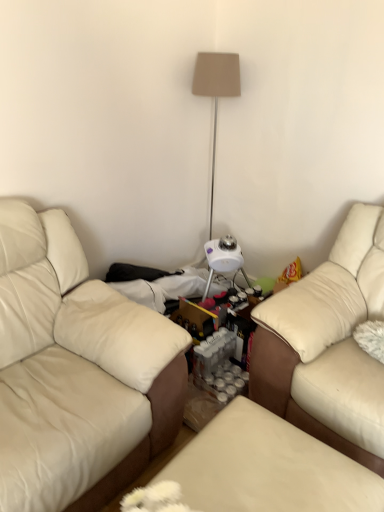
The height and width of the screenshot is (512, 384). What are the coordinates of `leather ottoman at center` in the screenshot? It's located at pos(268,468).

Where is `beige fabric lampshade at upper center`? The height and width of the screenshot is (512, 384). beige fabric lampshade at upper center is located at coordinates (216, 91).

The image size is (384, 512). Identify the location of beige leather couch at left, the first studio couch when ordered from left to right. (76, 371).

Is leather ottoman at center not near leather couch at right, which is the 1th studio couch in right-to-left order?

No, there isn't a large distance between leather ottoman at center and leather couch at right, which is the 1th studio couch in right-to-left order.

Considering the points (249, 436) and (381, 281), which point is behind, point (249, 436) or point (381, 281)?

Point (381, 281)

Could you tell me if leather ottoman at center is turned towards leather couch at right, positioned as the 2th studio couch in left-to-right order?

No, leather ottoman at center is not turned towards leather couch at right, positioned as the 2th studio couch in left-to-right order.

Who is shorter, leather ottoman at center or leather couch at right, which is the 1th studio couch in right-to-left order?

leather ottoman at center.

Based on the photo, from their relative heights in the image, would you say beige leather couch at left, the 2th studio couch from the right, is taller or shorter than leather ottoman at center?

In the image, beige leather couch at left, the 2th studio couch from the right, appears to be taller than leather ottoman at center.

Is leather ottoman at center a part of beige leather couch at left, the first studio couch when ordered from left to right?

No, leather ottoman at center is not surrounded by beige leather couch at left, the first studio couch when ordered from left to right.

From the picture: Is beige leather couch at left, the first studio couch when ordered from left to right, thinner than leather ottoman at center?

In fact, beige leather couch at left, the first studio couch when ordered from left to right, might be wider than leather ottoman at center.

Locate an element on the screen. The height and width of the screenshot is (512, 384). studio couch that is the 1st one when counting backward from the leather ottoman at center is located at coordinates (76, 371).

Does beige fabric lampshade at upper center have a lesser height compared to leather couch at right, which is the 1th studio couch in right-to-left order?

No, beige fabric lampshade at upper center is not shorter than leather couch at right, which is the 1th studio couch in right-to-left order.

Is leather couch at right, positioned as the 2th studio couch in left-to-right order, inside beige fabric lampshade at upper center?

No, leather couch at right, positioned as the 2th studio couch in left-to-right order, is not surrounded by beige fabric lampshade at upper center.

Between beige fabric lampshade at upper center and leather couch at right, positioned as the 2th studio couch in left-to-right order, which one has smaller size?

Smaller between the two is beige fabric lampshade at upper center.

In the scene shown: Which is more to the right, beige fabric lampshade at upper center or leather couch at right, positioned as the 2th studio couch in left-to-right order?

From the viewer's perspective, leather couch at right, positioned as the 2th studio couch in left-to-right order, appears more on the right side.

Considering the sizes of objects beige fabric lampshade at upper center and leather ottoman at center in the image provided, who is wider, beige fabric lampshade at upper center or leather ottoman at center?

leather ottoman at center.

Is the position of beige fabric lampshade at upper center more distant than that of leather ottoman at center?

Yes, the depth of beige fabric lampshade at upper center is greater than that of leather ottoman at center.

Who is taller, beige fabric lampshade at upper center or leather ottoman at center?

Standing taller between the two is beige fabric lampshade at upper center.

Does beige fabric lampshade at upper center have a greater width compared to beige leather couch at left, the first studio couch when ordered from left to right?

No.

Which object is closer to the camera taking this photo, beige fabric lampshade at upper center or beige leather couch at left, the 2th studio couch from the right?

beige leather couch at left, the 2th studio couch from the right, is closer to the camera.

Is beige fabric lampshade at upper center aimed at beige leather couch at left, the 2th studio couch from the right?

No, beige fabric lampshade at upper center is not aimed at beige leather couch at left, the 2th studio couch from the right.

From the picture: Does leather couch at right, which is the 1th studio couch in right-to-left order, touch beige fabric lampshade at upper center?

No.

From a real-world perspective, is leather couch at right, positioned as the 2th studio couch in left-to-right order, physically below beige fabric lampshade at upper center?

Yes, from a real-world perspective, leather couch at right, positioned as the 2th studio couch in left-to-right order, is below beige fabric lampshade at upper center.

Between point (255, 390) and point (237, 86), which one is positioned in front?

The point (255, 390) is closer.

Is leather couch at right, positioned as the 2th studio couch in left-to-right order, facing towards beige fabric lampshade at upper center?

No, leather couch at right, positioned as the 2th studio couch in left-to-right order, is not turned towards beige fabric lampshade at upper center.

From a real-world perspective, is beige leather couch at left, the first studio couch when ordered from left to right, physically located above or below leather couch at right, which is the 1th studio couch in right-to-left order?

In terms of real-world spatial position, beige leather couch at left, the first studio couch when ordered from left to right, is below leather couch at right, which is the 1th studio couch in right-to-left order.

Which object is positioned more to the left, beige leather couch at left, the 2th studio couch from the right, or leather couch at right, positioned as the 2th studio couch in left-to-right order?

beige leather couch at left, the 2th studio couch from the right.

Is the surface of beige leather couch at left, the first studio couch when ordered from left to right, in direct contact with leather couch at right, positioned as the 2th studio couch in left-to-right order?

beige leather couch at left, the first studio couch when ordered from left to right, and leather couch at right, positioned as the 2th studio couch in left-to-right order, are clearly separated.

Can you tell me how much beige leather couch at left, the first studio couch when ordered from left to right, and leather couch at right, which is the 1th studio couch in right-to-left order, differ in facing direction?

The angular difference between beige leather couch at left, the first studio couch when ordered from left to right, and leather couch at right, which is the 1th studio couch in right-to-left order, is 90.3 degrees.

Identify the location of studio couch on the right of leather ottoman at center. (328, 345).

From a real-world perspective, starting from the leather ottoman at center, which studio couch is the 1st one vertically above it? Please provide its 2D coordinates.

[(76, 371)]

In the scene shown: When comparing their distances from leather couch at right, which is the 1th studio couch in right-to-left order, does beige leather couch at left, the 2th studio couch from the right, or leather ottoman at center seem closer?

Among the two, leather ottoman at center is located nearer to leather couch at right, which is the 1th studio couch in right-to-left order.

Which object lies further to the anchor point beige fabric lampshade at upper center, leather couch at right, which is the 1th studio couch in right-to-left order, or beige leather couch at left, the 2th studio couch from the right?

Based on the image, beige leather couch at left, the 2th studio couch from the right, appears to be further to beige fabric lampshade at upper center.

Estimate the real-world distances between objects in this image. Which object is further from leather ottoman at center, beige fabric lampshade at upper center or leather couch at right, positioned as the 2th studio couch in left-to-right order?

beige fabric lampshade at upper center is further to leather ottoman at center.

From the image, which object appears to be nearer to beige fabric lampshade at upper center, leather ottoman at center or leather couch at right, which is the 1th studio couch in right-to-left order?

leather couch at right, which is the 1th studio couch in right-to-left order, lies closer to beige fabric lampshade at upper center than the other object.

Looking at the image, which one is located closer to leather ottoman at center, beige leather couch at left, the 2th studio couch from the right, or beige fabric lampshade at upper center?

The object closer to leather ottoman at center is beige leather couch at left, the 2th studio couch from the right.

Considering their positions, is beige fabric lampshade at upper center positioned further to leather ottoman at center than beige leather couch at left, the 2th studio couch from the right?

beige fabric lampshade at upper center is further to leather ottoman at center.

When comparing their distances from beige leather couch at left, the 2th studio couch from the right, does leather ottoman at center or beige fabric lampshade at upper center seem further?

The object further to beige leather couch at left, the 2th studio couch from the right, is beige fabric lampshade at upper center.

Based on their spatial positions, is beige leather couch at left, the 2th studio couch from the right, or beige fabric lampshade at upper center closer to leather couch at right, which is the 1th studio couch in right-to-left order?

Based on the image, beige leather couch at left, the 2th studio couch from the right, appears to be nearer to leather couch at right, which is the 1th studio couch in right-to-left order.

Find the location of a particular element. This screenshot has height=512, width=384. table lamp located between beige leather couch at left, the 2th studio couch from the right, and leather couch at right, which is the 1th studio couch in right-to-left order, in the left-right direction is located at coordinates (216, 91).

Locate an element on the screen. swivel chair located between beige leather couch at left, the first studio couch when ordered from left to right, and leather couch at right, which is the 1th studio couch in right-to-left order, in the left-right direction is located at coordinates point(268,468).